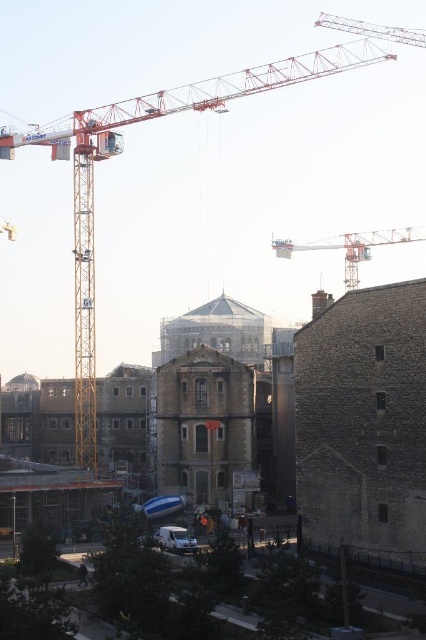
You are a construction worker who needs to choose a crane to lift heavy materials. Both the orange metallic crane at upper left and the orange metallic crane at upper center are available. Which crane should you choose based on their sizes?

You should choose the orange metallic crane at upper left because it is bigger than the orange metallic crane at upper center, making it more suitable for lifting heavy materials.

You are standing at the entrance of the construction site and want to reach the brown stone tower at center. Based on the coordinates provided in the Objects Description, in which general direction should you head from your current position?

The brown stone tower at center is located at coordinates approximately 0.664 on the x axis and 0.479 on the y axis. Since you are at the entrance, which is likely at the lower left corner of the image, you should head northeast to reach the tower.